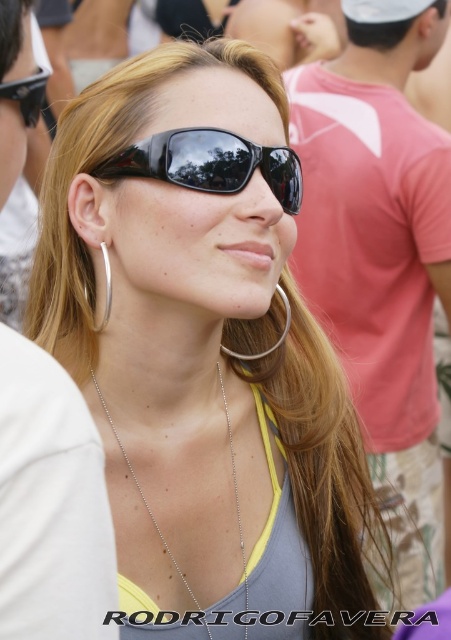
Is black plastic sunglasses at upper center bigger than silver metallic hoop at center?

Incorrect, black plastic sunglasses at upper center is not larger than silver metallic hoop at center.

Which is in front, point (10, 93) or point (276, 340)?

Point (10, 93)

Identify the location of black plastic sunglasses at upper center. This screenshot has height=640, width=451. (27, 93).

Which is more to the right, black plastic sunglasses at center or silver chain necklace at center?

black plastic sunglasses at center

Does black plastic sunglasses at center appear on the right side of silver chain necklace at center?

Yes, black plastic sunglasses at center is to the right of silver chain necklace at center.

Who is more forward, (176, 161) or (110, 426)?

Point (176, 161) is in front.

This screenshot has width=451, height=640. In order to click on black plastic sunglasses at center in this screenshot , I will do `click(210, 163)`.

Between silver chain necklace at center and silver metallic hoop at left, which one is positioned lower?

silver chain necklace at center is below.

Which is in front, point (207, 627) or point (101, 324)?

Point (207, 627) is in front.

Where is `silver chain necklace at center`? The width and height of the screenshot is (451, 640). silver chain necklace at center is located at coordinates (143, 497).